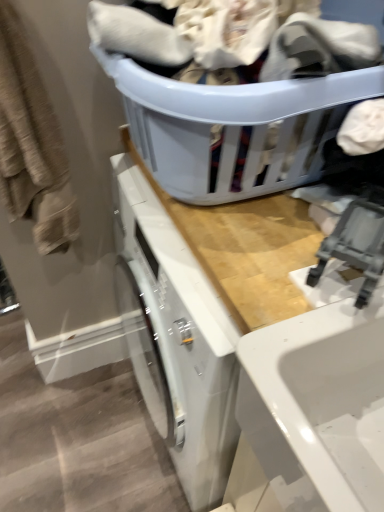
Question: Based on their sizes in the image, would you say beige textured towel at left is bigger or smaller than wooden counter at upper center?

Choices:
 (A) small
 (B) big

Answer: (A)

Question: Based on their positions, is beige textured towel at left located to the left or right of wooden counter at upper center?

Choices:
 (A) right
 (B) left

Answer: (B)

Question: Considering the real-world distances, which object is farthest from the wooden counter at upper center?

Choices:
 (A) beige textured towel at left
 (B) matte plastic laundry basket at upper center

Answer: (A)

Question: Based on their relative distances, which object is farther from the matte plastic laundry basket at upper center?

Choices:
 (A) wooden counter at upper center
 (B) beige textured towel at left

Answer: (B)